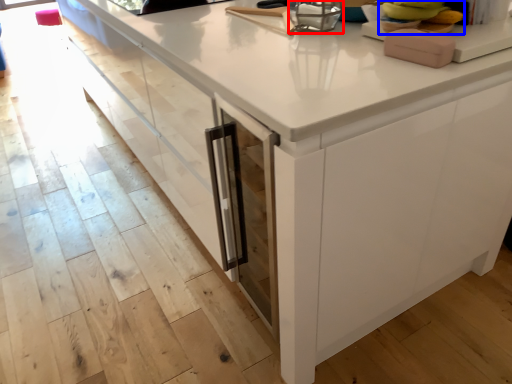
Question: Among these objects, which one is farthest to the camera, appliance (highlighted by a red box) or food (highlighted by a blue box)?

Choices:
 (A) appliance
 (B) food

Answer: (A)